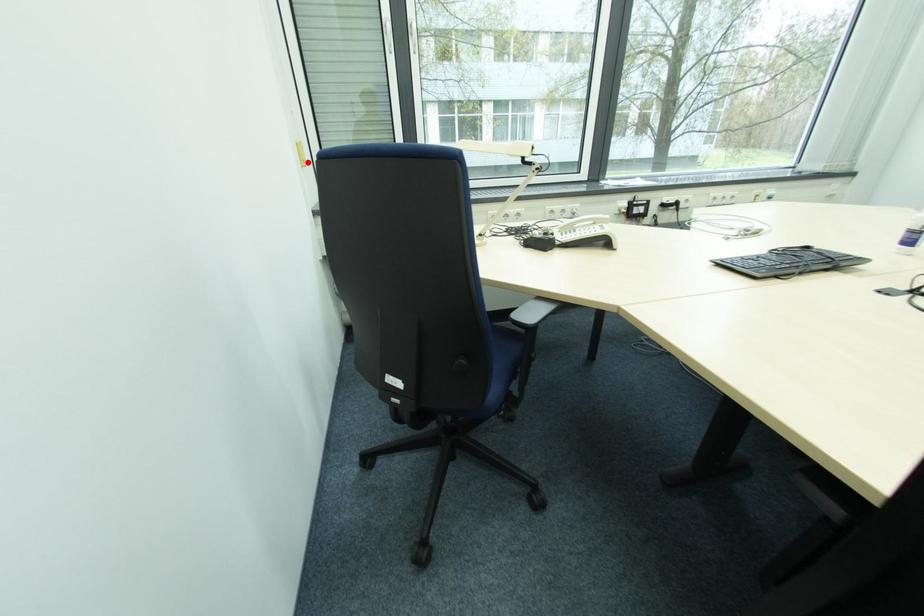
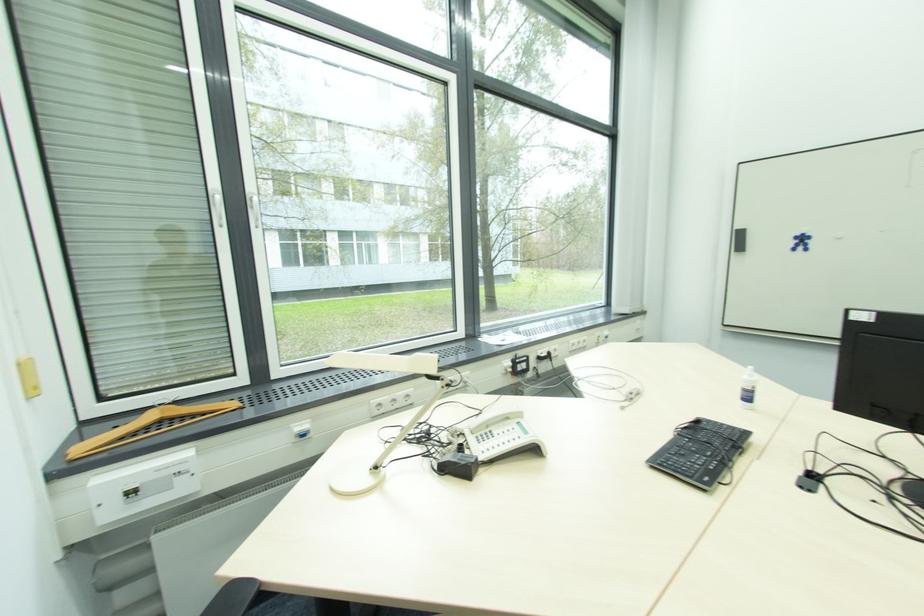
Question: I am providing you with two images of the same scene from different viewpoints. A red point is marked on the first image. Can you still see the location of the red point in image 2?

Choices:
 (A) Yes
 (B) No

Answer: (A)